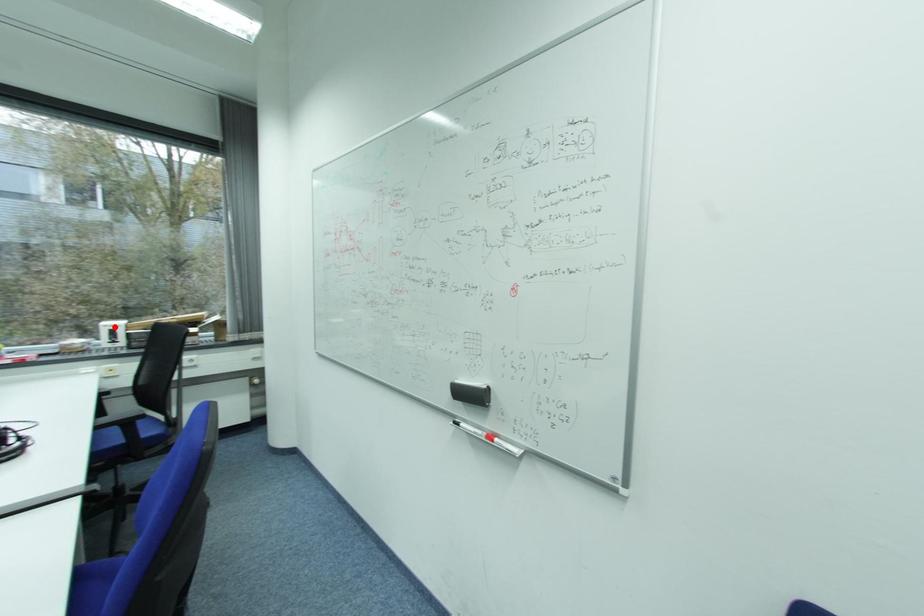
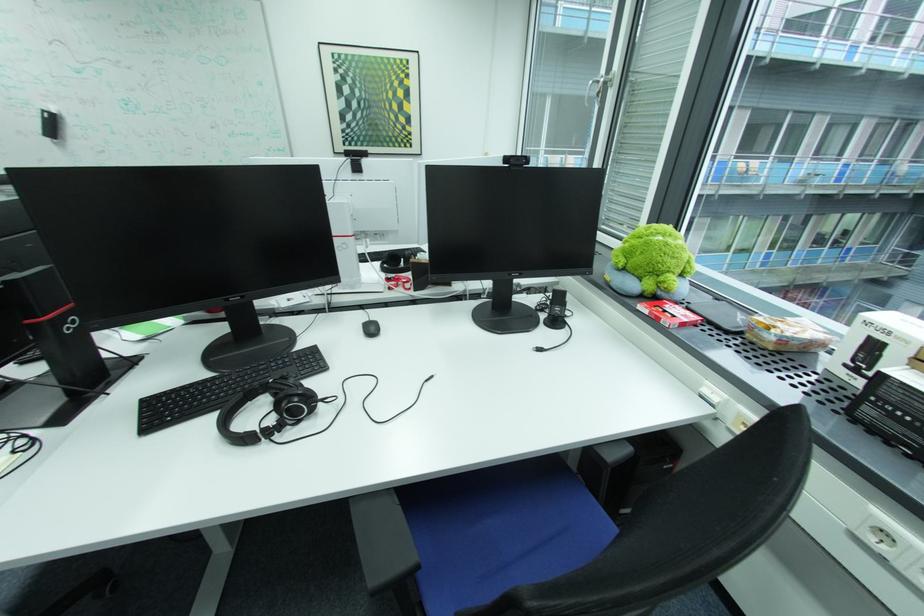
Question: A red point is marked in image1. In image2, is the corresponding 3D point closer to the camera or farther? Reply with the corresponding letter.

Choices:
 (A) The corresponding 3D point is closer.
 (B) The corresponding 3D point is farther.

Answer: (B)